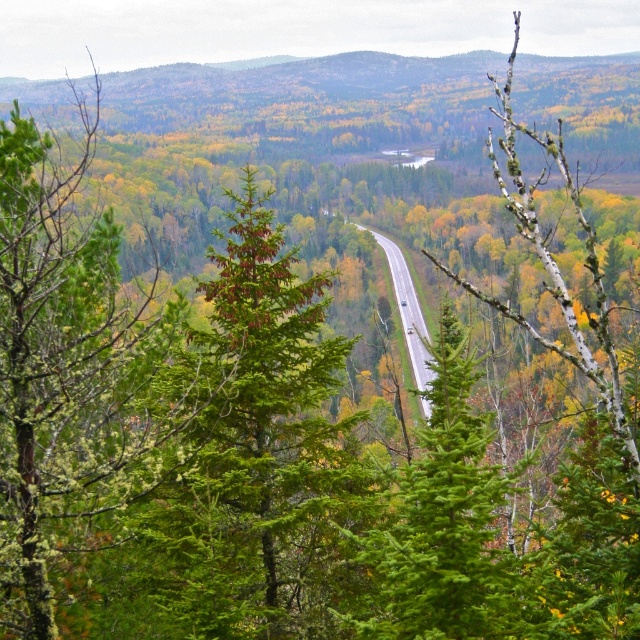
Is the position of green leafy tree at center less distant than that of asphalt road at center?

Yes, it is.

Which is in front, point (428, 518) or point (360, 225)?

Point (428, 518) is more forward.

This screenshot has height=640, width=640. I want to click on green leafy tree at center, so click(x=445, y=524).

Which is in front, point (276, 573) or point (412, 308)?

Positioned in front is point (276, 573).

Who is higher up, green needle-like tree at center or asphalt road at center?

asphalt road at center

Between point (193, 483) and point (400, 257), which one is positioned behind?

The point (400, 257) is more distant.

Where is `green needle-like tree at center`? This screenshot has height=640, width=640. green needle-like tree at center is located at coordinates (260, 460).

Between green needle-like tree at center and green leafy tree at center, which one appears on the left side from the viewer's perspective?

Positioned to the left is green needle-like tree at center.

Based on the photo, is the position of green needle-like tree at center less distant than that of green leafy tree at center?

No, it is behind green leafy tree at center.

Does point (243, 284) lie behind point (513, 595)?

Yes.

The width and height of the screenshot is (640, 640). Find the location of `green needle-like tree at center`. green needle-like tree at center is located at coordinates (260, 460).